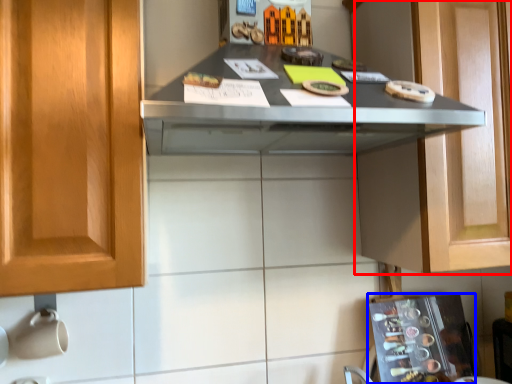
Question: Among these objects, which one is nearest to the camera, cabinetry (highlighted by a red box) or appliance (highlighted by a blue box)?

Choices:
 (A) cabinetry
 (B) appliance

Answer: (A)